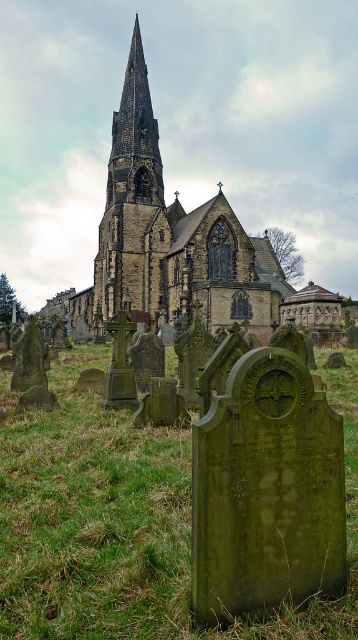
Between point (354, 544) and point (141, 241), which one is positioned in front?

Point (354, 544)

Between point (131, 486) and point (112, 202), which one is positioned behind?

The point (112, 202) is more distant.

Where is `green mossy gravestone at center`? The image size is (358, 640). green mossy gravestone at center is located at coordinates (126, 522).

The image size is (358, 640). Identify the location of green mossy gravestone at center. (126, 522).

Who is more distant from viewer, [239,221] or [115,128]?

The point [115,128] is more distant.

Who is more forward, (207, 260) or (156, 218)?

Point (207, 260) is in front.

You are a GUI agent. You are given a task and a screenshot of the screen. Output one action in this format:
    pyautogui.click(x=<x>, y=<y>)
    Task: Click on the dark stone church at center
    
    Given the screenshot: What is the action you would take?
    pyautogui.click(x=176, y=241)

In the scene shown: Between green mossy gravestone at center and dark stone church at center, which one is positioned lower?

green mossy gravestone at center is lower down.

Who is positioned more to the right, green mossy gravestone at center or dark stone church at center?

green mossy gravestone at center

Identify the location of green mossy gravestone at center. (126, 522).

Find the location of a particular element. Image resolution: width=358 pixels, height=640 pixels. green mossy gravestone at center is located at coordinates (126, 522).